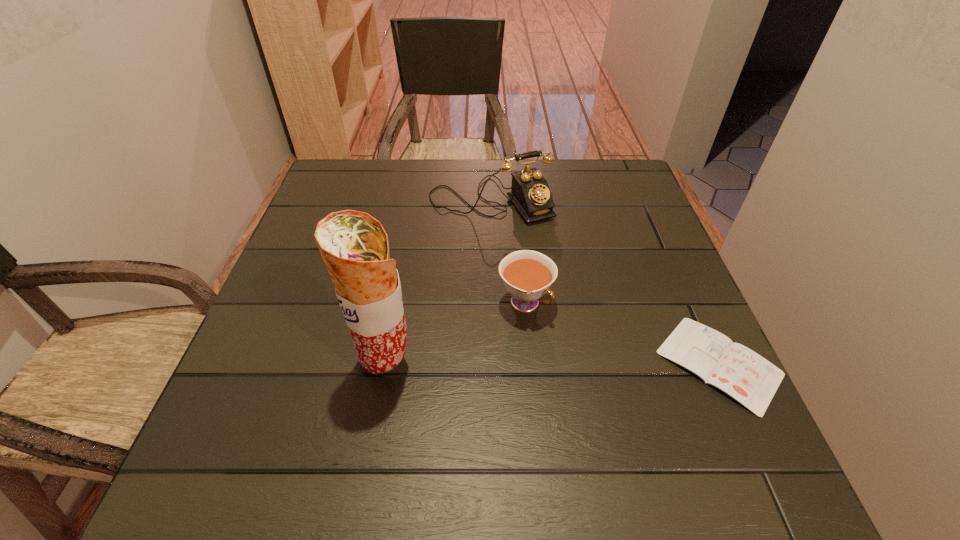
I want to click on vacant space situated on the dial of the farthest object, so click(x=556, y=288).

Where is `blank space located 0.140m on the side of the second shortest object with the handle`? blank space located 0.140m on the side of the second shortest object with the handle is located at coordinates (599, 363).

The width and height of the screenshot is (960, 540). Identify the location of vacant space located 0.250m on the side of the second shortest object with the handle. (649, 403).

Locate an element on the screen. The height and width of the screenshot is (540, 960). vacant space located 0.210m on the side of the second shortest object with the handle is located at coordinates (630, 388).

Locate an element on the screen. object that is at the far edge is located at coordinates (530, 193).

Find the location of `object at the near edge`. object at the near edge is located at coordinates (750, 379).

You are a GUI agent. You are given a task and a screenshot of the screen. Output one action in this format:
    pyautogui.click(x=<x>, y=<y>)
    Task: Click on the object that is positioned at the right edge
    This screenshot has width=960, height=540.
    Given the screenshot: What is the action you would take?
    pyautogui.click(x=750, y=379)

Find the location of a particular element. The width and height of the screenshot is (960, 540). object located at the near right corner is located at coordinates (750, 379).

In the image, there is a desktop. At what (x,y) coordinates should I click in order to perform the action: click on vacant space at the far edge. Please return your answer as a coordinate pair (x, y). Looking at the image, I should click on (480, 205).

Identify the location of vacant space at the near edge of the desktop. (320, 393).